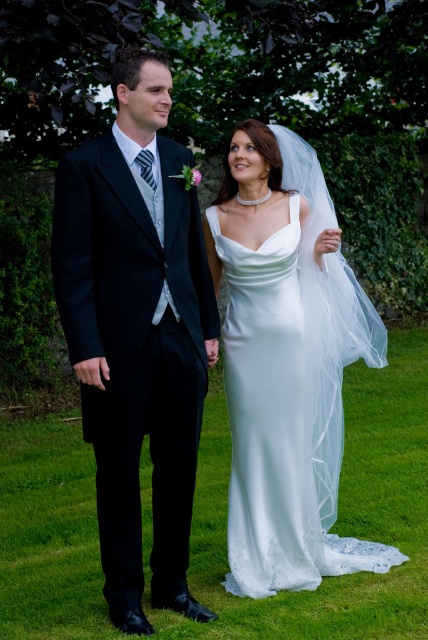
Question: Can you confirm if matte black suit at left is positioned below green grass at center?

Choices:
 (A) yes
 (B) no

Answer: (B)

Question: Which object is farther from the camera taking this photo?

Choices:
 (A) white satin dress at center
 (B) green grass at center
 (C) matte black suit at left

Answer: (B)

Question: Does matte black suit at left appear on the left side of green grass at center?

Choices:
 (A) yes
 (B) no

Answer: (A)

Question: Is green grass at center smaller than white satin dress at center?

Choices:
 (A) no
 (B) yes

Answer: (A)

Question: Which point appears farthest from the camera in this image?

Choices:
 (A) (205, 490)
 (B) (377, 561)

Answer: (A)

Question: Which of the following is the closest to the observer?

Choices:
 (A) matte black suit at left
 (B) green grass at center

Answer: (A)